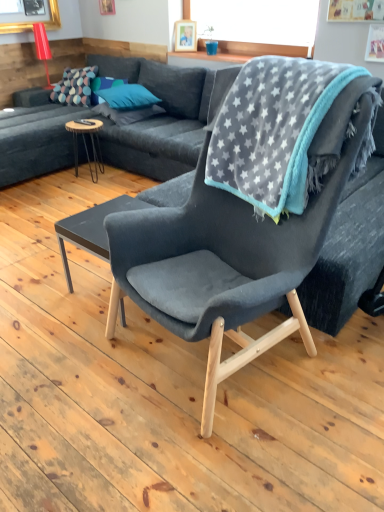
Question: Considering the positions of teal fabric pillow at upper left, the 3th pillow from the left, and dark gray fabric couch at upper left in the image, is teal fabric pillow at upper left, the 3th pillow from the left, bigger or smaller than dark gray fabric couch at upper left?

Choices:
 (A) small
 (B) big

Answer: (A)

Question: From a real-world perspective, is teal fabric pillow at upper left, the 3th pillow from the left, above or below dark gray fabric couch at upper left?

Choices:
 (A) below
 (B) above

Answer: (B)

Question: Based on their relative distances, which object is nearer to the teal fabric pillow at center, the second pillow viewed from the right?

Choices:
 (A) dark gray matte coffee table at center, acting as the second coffee table starting from the left
 (B) multicolored dotted fabric pillow at upper left, which is counted as the 3th pillow, starting from the right
 (C) velvet dark gray chair at center
 (D) gray star-patterned blanket at upper right
 (E) teal fabric pillow at upper left, the 3th pillow from the left

Answer: (B)

Question: Based on their relative distances, which object is farther from the teal fabric pillow at center, the 2th pillow from the left?

Choices:
 (A) wooden picture frame at upper center
 (B) dark gray fabric couch at upper left
 (C) gray star-patterned blanket at upper right
 (D) multicolored dotted fabric pillow at upper left, which is counted as the 3th pillow, starting from the right
 (E) wooden round table at left, which ranks as the 1th coffee table in top-to-bottom order

Answer: (C)